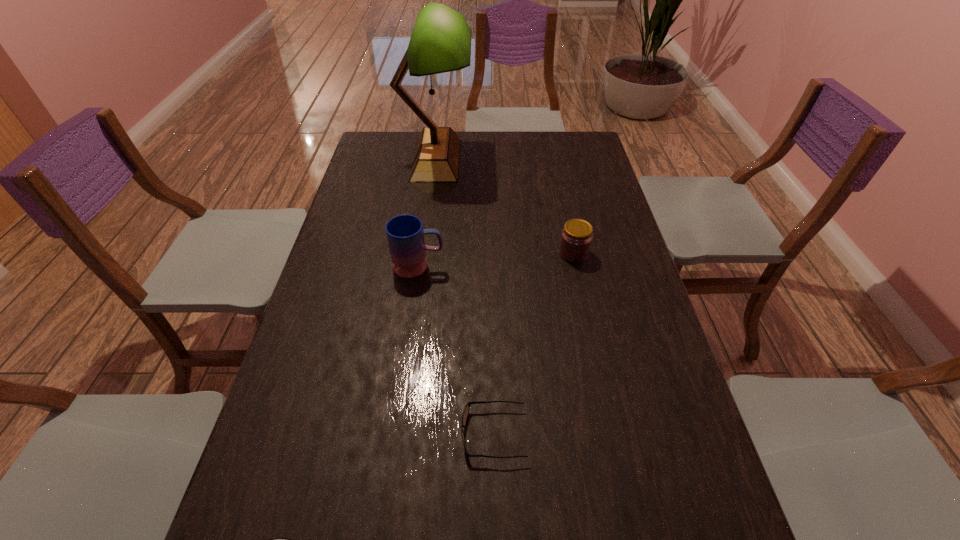
Where is `free space at the far left corner of the desktop`? The height and width of the screenshot is (540, 960). free space at the far left corner of the desktop is located at coordinates (393, 162).

The width and height of the screenshot is (960, 540). Identify the location of free spot between the second tallest object and the farthest object. (427, 213).

This screenshot has height=540, width=960. Find the location of `vacant area that lies between the third tallest object and the farthest object`. vacant area that lies between the third tallest object and the farthest object is located at coordinates (505, 206).

Where is `unoccupied position between the jam and the fourth tallest object`? The image size is (960, 540). unoccupied position between the jam and the fourth tallest object is located at coordinates (533, 343).

Where is `free space between the third shortest object and the tallest object`? The width and height of the screenshot is (960, 540). free space between the third shortest object and the tallest object is located at coordinates (x=505, y=206).

The width and height of the screenshot is (960, 540). I want to click on empty space between the sunglasses and the table lamp, so click(x=465, y=296).

Identify the location of object that ranks as the second closest to the second nearest object. The height and width of the screenshot is (540, 960). (405, 234).

Locate an element on the screen. The image size is (960, 540). the second closest object to the third shortest object is located at coordinates (440, 42).

The height and width of the screenshot is (540, 960). Find the location of `vacant area in the image that satisfies the following two spatial constraints: 1. on the front side of the rightmost object; 2. on the front-facing side of the second shortest object`. vacant area in the image that satisfies the following two spatial constraints: 1. on the front side of the rightmost object; 2. on the front-facing side of the second shortest object is located at coordinates (612, 434).